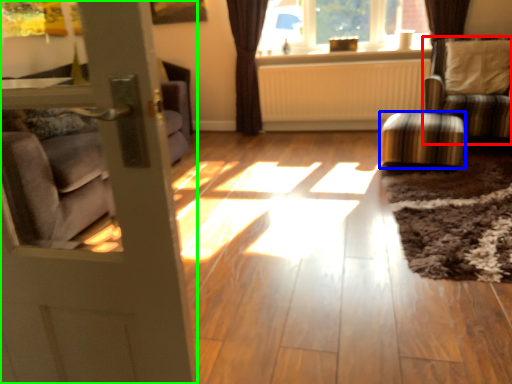
Question: Considering the real-world distances, which object is closest to chair (highlighted by a red box)? stool (highlighted by a blue box) or door (highlighted by a green box).

Choices:
 (A) stool
 (B) door

Answer: (A)